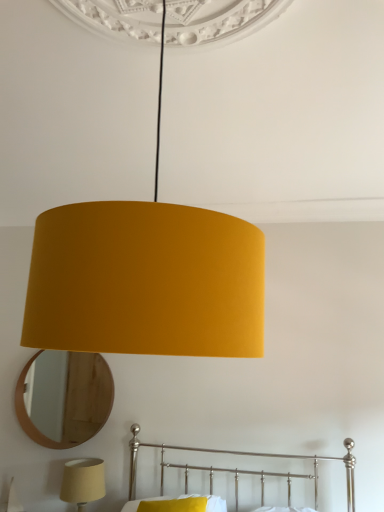
Question: Is wooden mirror at lower left closer to camera compared to yellow fabric pillow at lower center?

Choices:
 (A) no
 (B) yes

Answer: (A)

Question: Is wooden mirror at lower left far from yellow fabric pillow at lower center?

Choices:
 (A) yes
 (B) no

Answer: (B)

Question: Would you say wooden mirror at lower left is outside yellow fabric pillow at lower center?

Choices:
 (A) no
 (B) yes

Answer: (B)

Question: Can yellow fabric pillow at lower center be found inside wooden mirror at lower left?

Choices:
 (A) no
 (B) yes

Answer: (A)

Question: Can you confirm if wooden mirror at lower left is positioned to the left of yellow fabric pillow at lower center?

Choices:
 (A) no
 (B) yes

Answer: (B)

Question: From a real-world perspective, is wooden mirror at lower left physically located above or below yellow fabric pillow at lower center?

Choices:
 (A) below
 (B) above

Answer: (B)

Question: From their relative heights in the image, would you say wooden mirror at lower left is taller or shorter than yellow fabric pillow at lower center?

Choices:
 (A) tall
 (B) short

Answer: (A)

Question: In the image, is wooden mirror at lower left positioned in front of or behind yellow fabric pillow at lower center?

Choices:
 (A) front
 (B) behind

Answer: (B)

Question: Considering the relative positions of wooden mirror at lower left and yellow fabric pillow at lower center in the image provided, is wooden mirror at lower left to the left or to the right of yellow fabric pillow at lower center?

Choices:
 (A) left
 (B) right

Answer: (A)

Question: In the image, is metallic silver bed at lower center on the left side or the right side of matte yellow lampshade at lower left, which appears as the 1th lamp when viewed from the left?

Choices:
 (A) right
 (B) left

Answer: (A)

Question: From their relative heights in the image, would you say metallic silver bed at lower center is taller or shorter than matte yellow lampshade at lower left, which is the second lamp in top-to-bottom order?

Choices:
 (A) tall
 (B) short

Answer: (A)

Question: Is metallic silver bed at lower center in front of or behind matte yellow lampshade at lower left, which is the second lamp in front-to-back order, in the image?

Choices:
 (A) front
 (B) behind

Answer: (A)

Question: Based on their sizes in the image, would you say metallic silver bed at lower center is bigger or smaller than matte yellow lampshade at lower left, which appears as the 1th lamp when viewed from the left?

Choices:
 (A) big
 (B) small

Answer: (A)

Question: In terms of size, does matte yellow fabric lampshade at center, which is the second lamp from left to right, appear bigger or smaller than matte yellow lampshade at lower left, which is the second lamp in top-to-bottom order?

Choices:
 (A) small
 (B) big

Answer: (B)

Question: Is matte yellow fabric lampshade at center, which is the second lamp from left to right, wider or thinner than matte yellow lampshade at lower left, which is the second lamp in top-to-bottom order?

Choices:
 (A) thin
 (B) wide

Answer: (B)